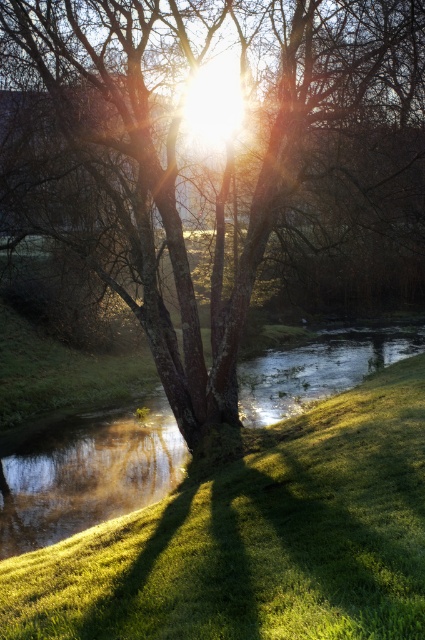
From the picture: Is smooth bark tree at center to the left of green grassy at center from the viewer's perspective?

Result: In fact, smooth bark tree at center is to the right of green grassy at center.

Between smooth bark tree at center and green grassy at center, which one appears on the right side from the viewer's perspective?

From the viewer's perspective, smooth bark tree at center appears more on the right side.

Is point (173, 385) more distant than point (379, 387)?

No.

Locate an element on the screen. Image resolution: width=425 pixels, height=640 pixels. smooth bark tree at center is located at coordinates (215, 161).